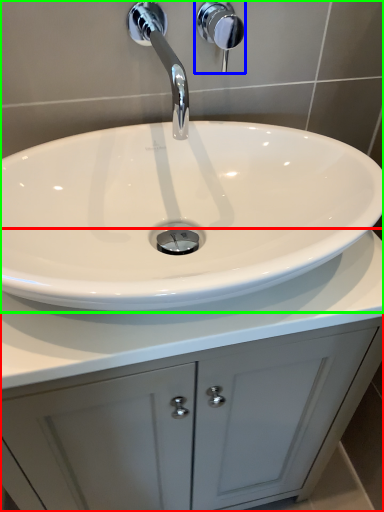
Question: Which object is positioned closest to bathroom cabinet (highlighted by a red box)? Select from shower (highlighted by a blue box) and sink (highlighted by a green box).

Choices:
 (A) shower
 (B) sink

Answer: (B)